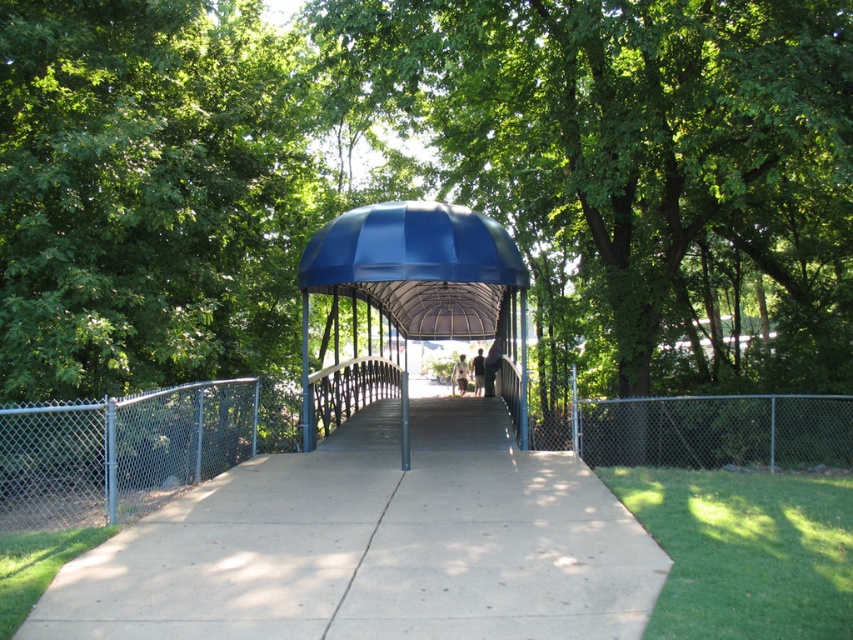
Who is positioned more to the left, green leafy tree at center or blue metal/glass gazebo at center?

Positioned to the left is blue metal/glass gazebo at center.

Is the position of green leafy tree at center less distant than that of blue metal/glass gazebo at center?

Yes, green leafy tree at center is in front of blue metal/glass gazebo at center.

At what (x,y) coordinates should I click in order to perform the action: click on green leafy tree at center. Please return your answer as a coordinate pair (x, y). Looking at the image, I should click on (637, 170).

The image size is (853, 640). In order to click on green leafy tree at center in this screenshot , I will do (x=637, y=170).

Is dark blue fabric person at center thinner than light brown fabric shirt at center?

Indeed, dark blue fabric person at center has a lesser width compared to light brown fabric shirt at center.

Measure the distance between dark blue fabric person at center and light brown fabric shirt at center.

dark blue fabric person at center and light brown fabric shirt at center are 19.51 feet apart.

Who is more distant from viewer, (498,360) or (462,364)?

Positioned behind is point (462,364).

The image size is (853, 640). I want to click on dark blue fabric person at center, so click(x=491, y=365).

Can you confirm if chain link fence at left is bigger than light brown fabric shirt at center?

Correct, chain link fence at left is larger in size than light brown fabric shirt at center.

Can you confirm if chain link fence at left is positioned to the right of light brown fabric shirt at center?

In fact, chain link fence at left is to the left of light brown fabric shirt at center.

Measure the distance between point (132, 465) and camera.

Point (132, 465) is 25.94 feet from camera.

Find the location of a particular element. chain link fence at left is located at coordinates (119, 452).